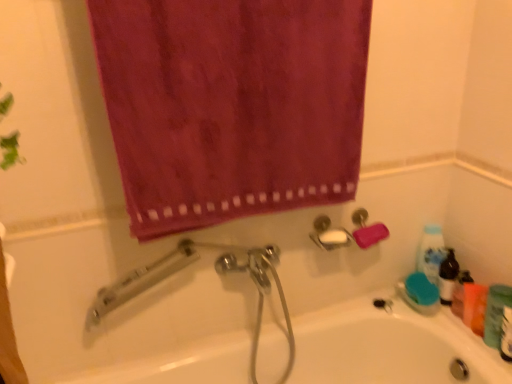
In order to click on vacant point to the left of green matte bottle at lower right in this screenshot , I will do `click(469, 348)`.